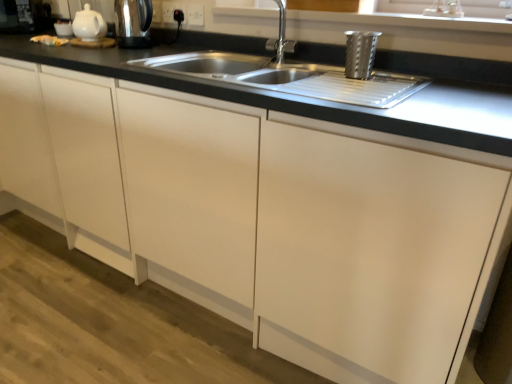
Locate an element on the screen. The image size is (512, 384). free spot below white glossy teapot at upper left (from a real-world perspective) is located at coordinates (93, 43).